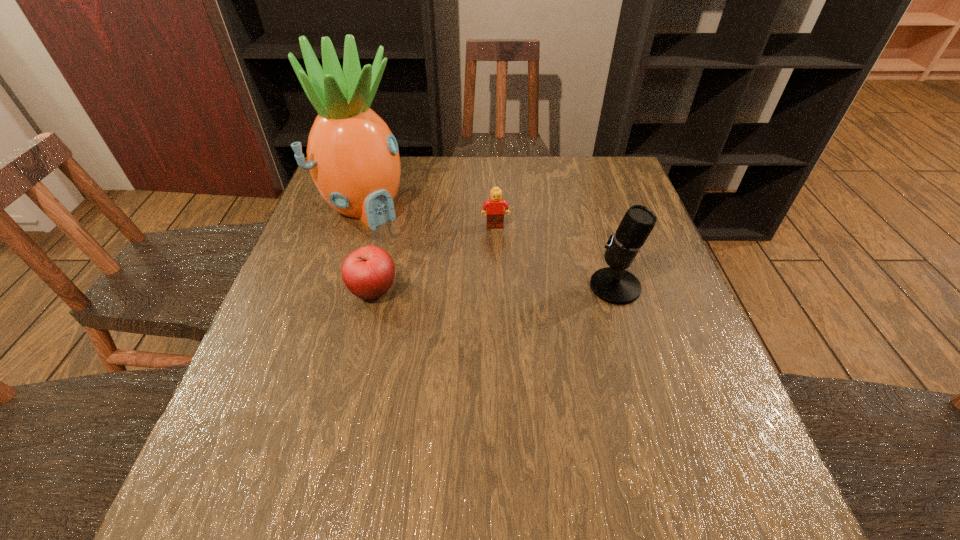
The height and width of the screenshot is (540, 960). I want to click on apple, so click(368, 272).

Find the location of a particular element. This screenshot has height=540, width=960. the rightmost object is located at coordinates (614, 285).

Identify the location of microphone. point(614,285).

This screenshot has width=960, height=540. I want to click on pineapple, so click(x=353, y=158).

You are a GUI agent. You are given a task and a screenshot of the screen. Output one action in this format:
    pyautogui.click(x=<x>, y=<y>)
    Task: Click on the second object from right to left
    
    Given the screenshot: What is the action you would take?
    pyautogui.click(x=495, y=212)

The height and width of the screenshot is (540, 960). I want to click on vacant area located on the right of the apple, so click(472, 291).

The height and width of the screenshot is (540, 960). Find the location of `free spot located 0.180m on the left of the rightmost object`. free spot located 0.180m on the left of the rightmost object is located at coordinates (513, 287).

Identify the location of free space located 0.100m at the entrance of the pineapple. This screenshot has width=960, height=540. (410, 241).

Identify the location of vacant space located at the entrance of the pineapple. [x=486, y=305].

Locate an element on the screen. This screenshot has height=540, width=960. blank space located at the entrance of the pineapple is located at coordinates (454, 279).